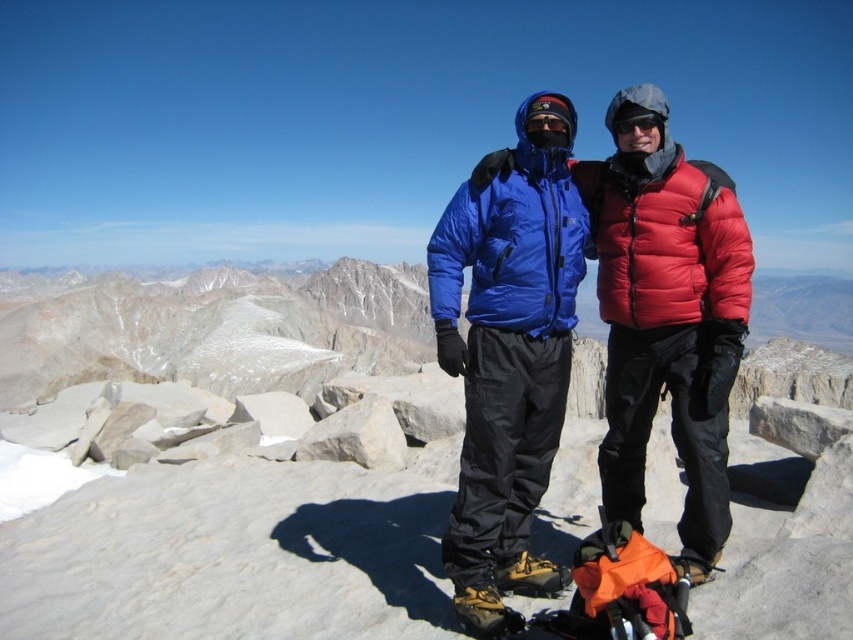
Question: Does matte blue jacket at center have a greater width compared to black matte goggles at center?

Choices:
 (A) no
 (B) yes

Answer: (B)

Question: Does matte blue jacket at center have a lesser width compared to black matte goggles at center?

Choices:
 (A) yes
 (B) no

Answer: (B)

Question: Is matte blue jacket at center thinner than black matte goggles at center?

Choices:
 (A) yes
 (B) no

Answer: (B)

Question: Among these points, which one is nearest to the camera?

Choices:
 (A) pyautogui.click(x=630, y=138)
 (B) pyautogui.click(x=648, y=131)

Answer: (B)

Question: Which of the following is the closest to the observer?

Choices:
 (A) (622, 115)
 (B) (616, 230)

Answer: (A)

Question: Among these objects, which one is farthest from the camera?

Choices:
 (A) black matte goggles at center
 (B) matte blue jacket at center

Answer: (A)